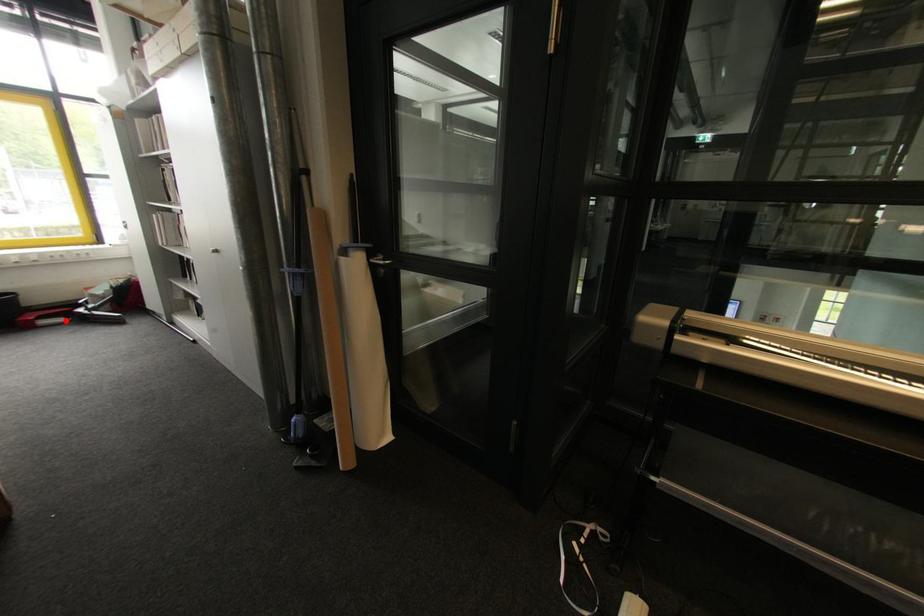
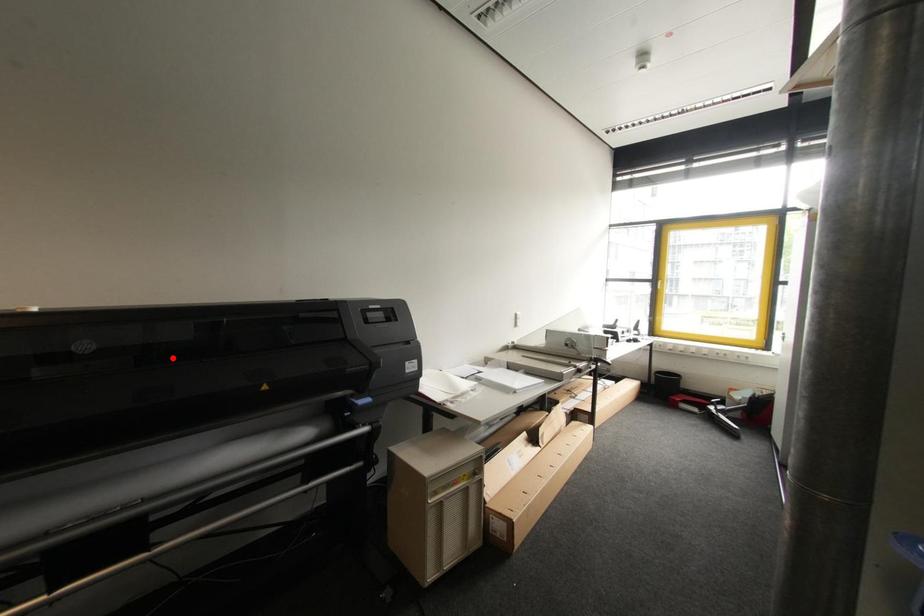
I am providing you with two images of the same scene from different viewpoints. A red point is marked on the first image and another point is marked on the second image. Is the marked point in image1 the same physical position as the marked point in image2?

No